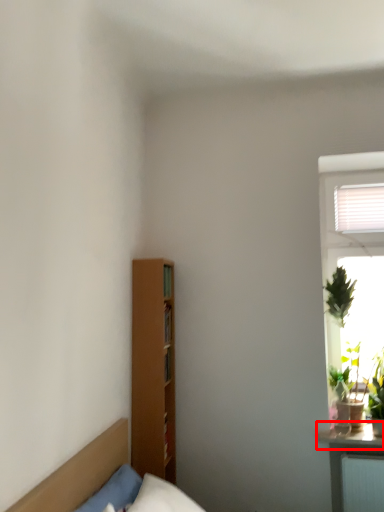
Question: From the image's perspective, where is window sill (annotated by the red box) located in relation to furniture in the image?

Choices:
 (A) above
 (B) below

Answer: (B)